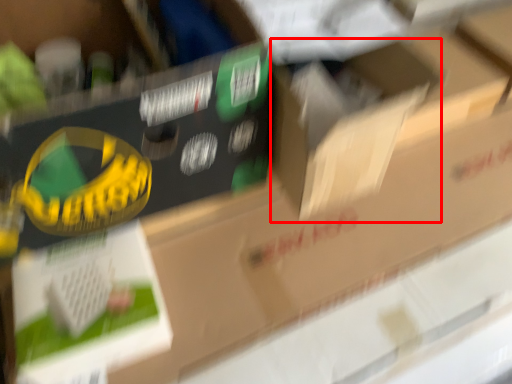
Question: From the image's perspective, what is the correct spatial positioning of cardboard box (annotated by the red box) in reference to storage box?

Choices:
 (A) above
 (B) below

Answer: (B)